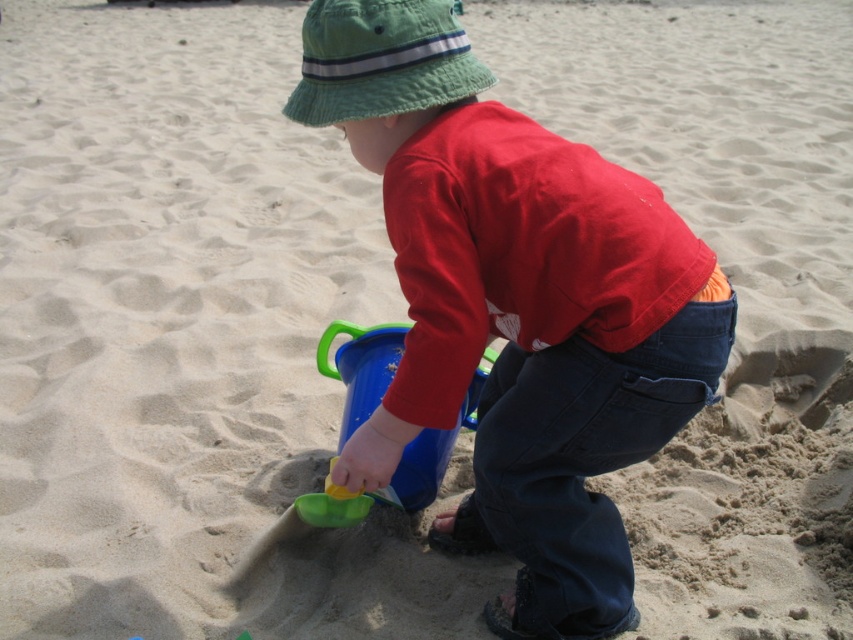
You are a photographer standing at the beach scene. You want to take a photo focusing on the matte blue bucket at center and the green fabric hat at upper center. Which object will appear larger in the photo?

The matte blue bucket at center will appear larger in the photo because it is closer to the viewer than the green fabric hat at upper center.

You are a parent trying to choose a bucket for your child to collect seashells. You see the matte blue bucket at center and the green plastic bucket at center. Which bucket has a larger capacity?

The matte blue bucket at center has a larger capacity since it is bigger than the green plastic bucket at center.

You are helping a child at the beach and need to choose a bucket to fill with sand. The matte blue bucket at center and the green plastic bucket at center are both available. Which bucket has a larger width?

The matte blue bucket at center has a larger width than the green plastic bucket at center according to the description.